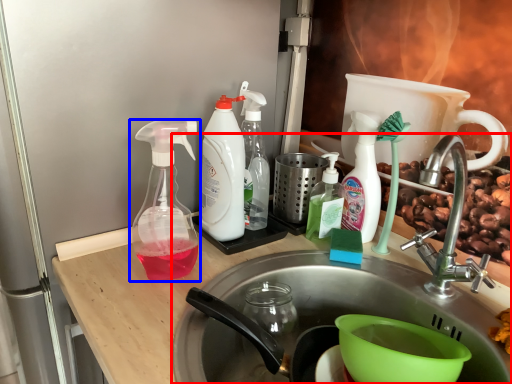
Question: Which object is closer to the camera taking this photo, sink (highlighted by a red box) or bottle (highlighted by a blue box)?

Choices:
 (A) sink
 (B) bottle

Answer: (A)